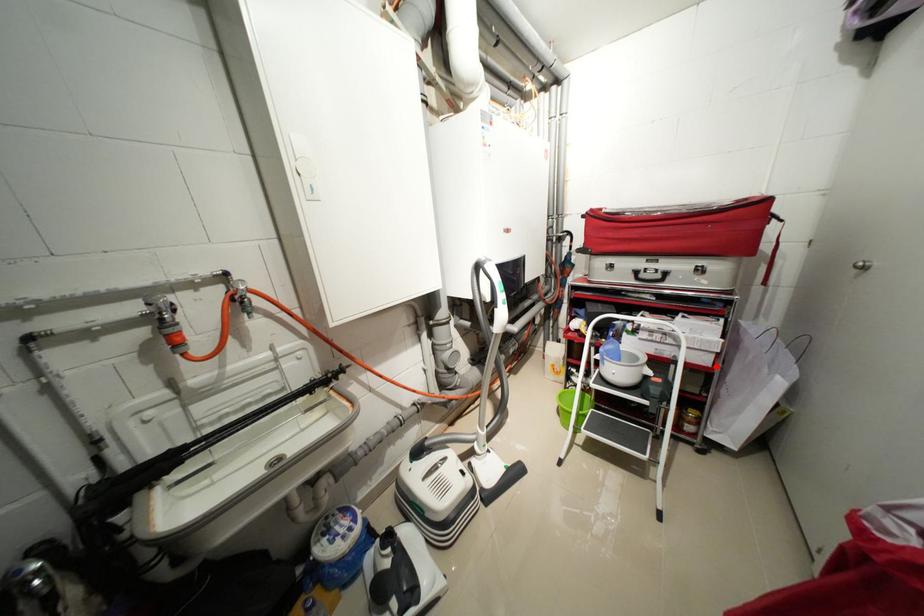
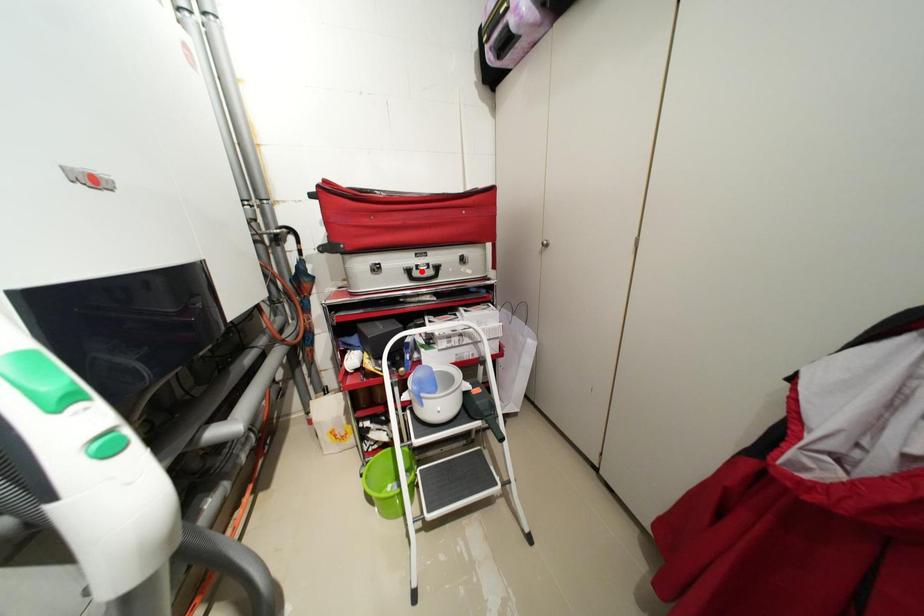
I am providing you with two images of the same scene from different viewpoints. A red point is marked on the first image and another point is marked on the second image. Is the marked point in image1 the same physical position as the marked point in image2?

No